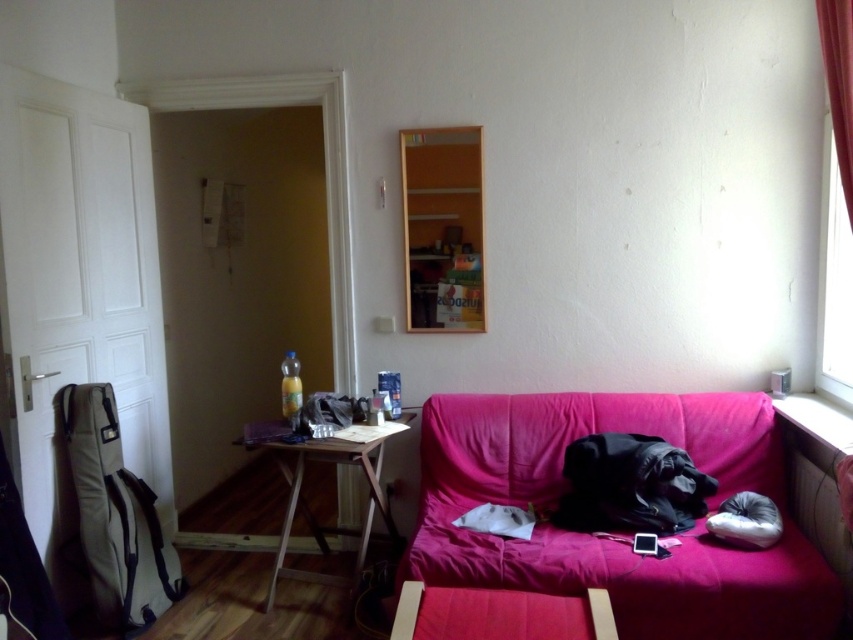
You are standing in the room and want to place a 3.2 meter long ladder in the image. Can you fit the ladder horizontally along the direction from the camera to the point at coordinate point [340,531]? Please answer based on the distance provided.

The distance from the camera to the point at coordinate point [340,531] is 3.35 meters. Since the ladder is 3.2 meters long, it can fit horizontally along that direction as the available space is slightly longer than the ladder.

Looking at this image, you are a delivery robot with a package that needs to be placed on the pink fabric couch at lower right. The robot is 24 inches wide. Can you move directly from the transparent glass window at right to the couch without any obstacles?

The pink fabric couch at lower right is 36.27 inches away from the transparent glass window at right. Since the robot is 24 inches wide, there is enough space between them for the robot to move directly from the transparent glass window at right to the couch without any obstacles.